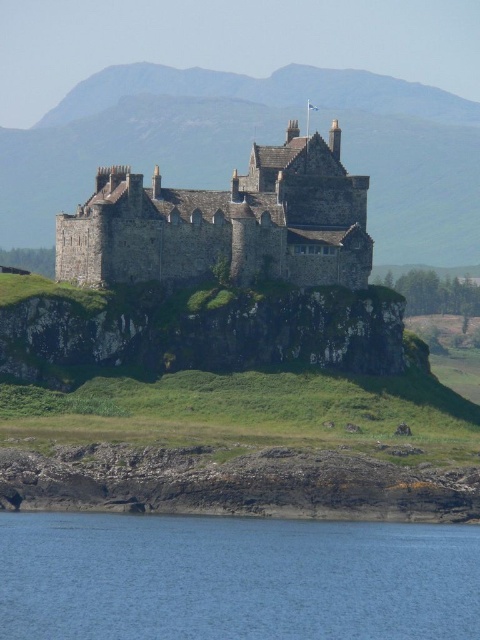
You are standing at the base of the brown stone castle at center and want to reach the blue water at lower left. Which direction should you head towards?

You should head towards the left direction to reach the blue water at lower left from the brown stone castle at center.

You are an architect planning to build a new tower adjacent to the brown stone castle at center and the stone medieval castle at center. Which castle should you consider for the base of your new tower to ensure it aligns with the existing structures in terms of height?

You should consider the brown stone castle at center for the base of your new tower because it has a greater height compared to the stone medieval castle at center, ensuring alignment with the taller structure.

You are a tour guide leading a group near the castle. You want to inform your group about the closest body of water to the castle. Based on the scene, can you tell them how far the blue water at lower left is from the brown stone castle at center?

The blue water at lower left is 69.13 meters away from the brown stone castle at center, so that is the closest body of water to the castle.